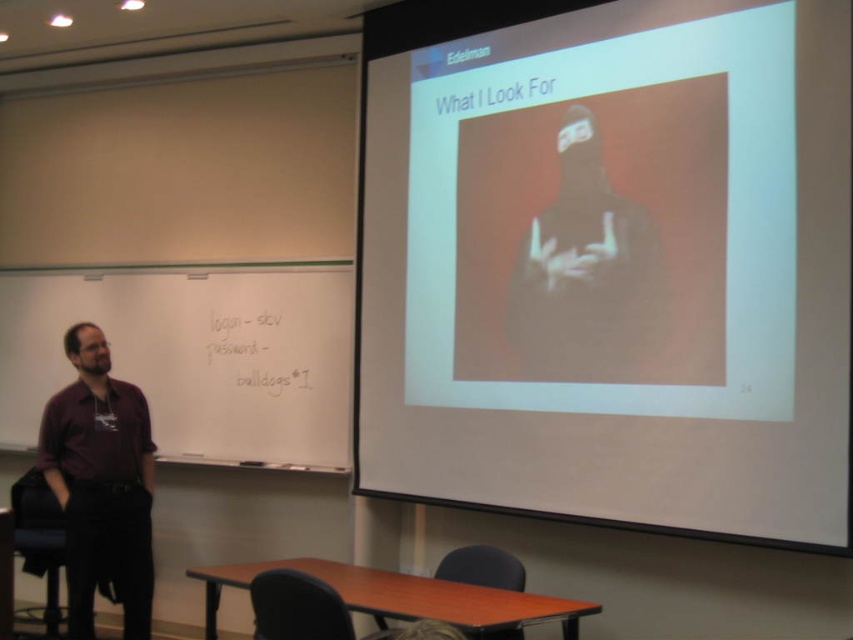
Between point (117, 564) and point (312, 580), which one is positioned in front?

Point (312, 580)

Based on the photo, between dark red shirt at left and dark brown leather chair at lower center, which one appears on the right side from the viewer's perspective?

From the viewer's perspective, dark brown leather chair at lower center appears more on the right side.

Is point (78, 609) less distant than point (341, 618)?

No.

Image resolution: width=853 pixels, height=640 pixels. What are the coordinates of `dark red shirt at left` in the screenshot? It's located at pyautogui.click(x=102, y=484).

Which of these two, dark red shirt at left or smooth black chair at lower center, stands shorter?

smooth black chair at lower center is shorter.

Is dark red shirt at left thinner than smooth black chair at lower center?

In fact, dark red shirt at left might be wider than smooth black chair at lower center.

The width and height of the screenshot is (853, 640). I want to click on dark red shirt at left, so click(102, 484).

Is handwritten text at whiteboard left wider than dark brown leather chair at lower center?

Indeed, handwritten text at whiteboard left has a greater width compared to dark brown leather chair at lower center.

Can you confirm if handwritten text at whiteboard left is positioned to the left of dark brown leather chair at lower center?

Correct, you'll find handwritten text at whiteboard left to the left of dark brown leather chair at lower center.

Where is `handwritten text at whiteboard left`? The image size is (853, 640). handwritten text at whiteboard left is located at coordinates [x=260, y=352].